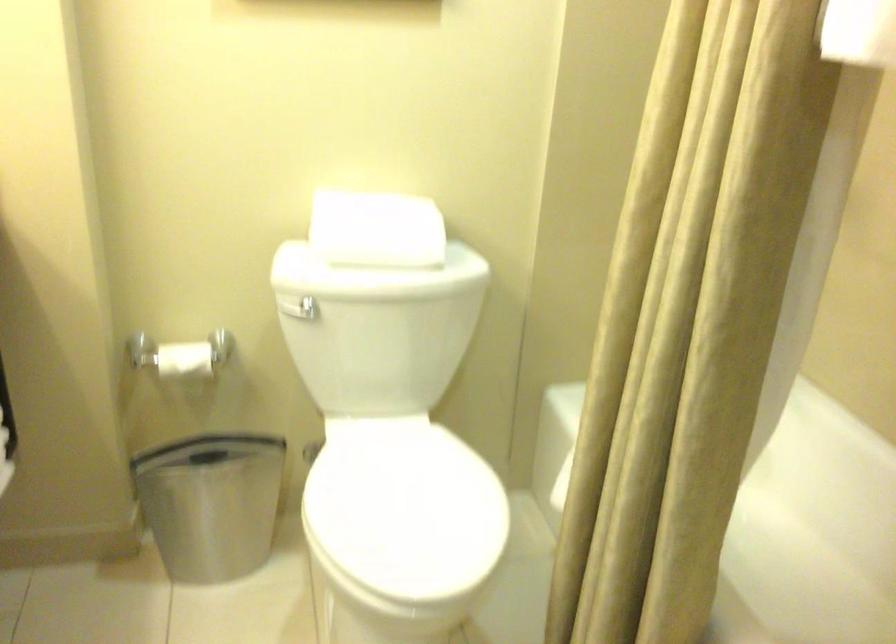
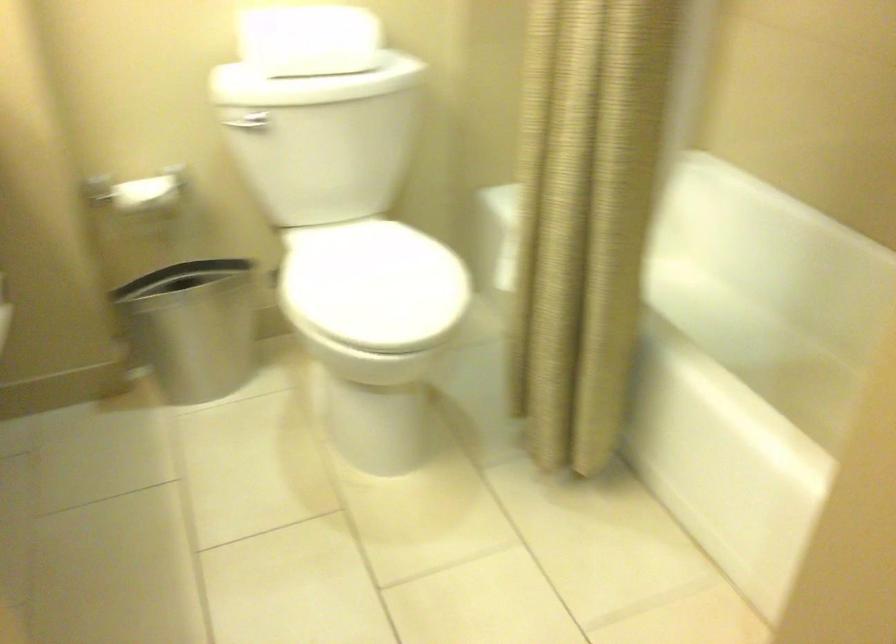
Find the pixel in the second image that matches [209,507] in the first image.

(194, 327)